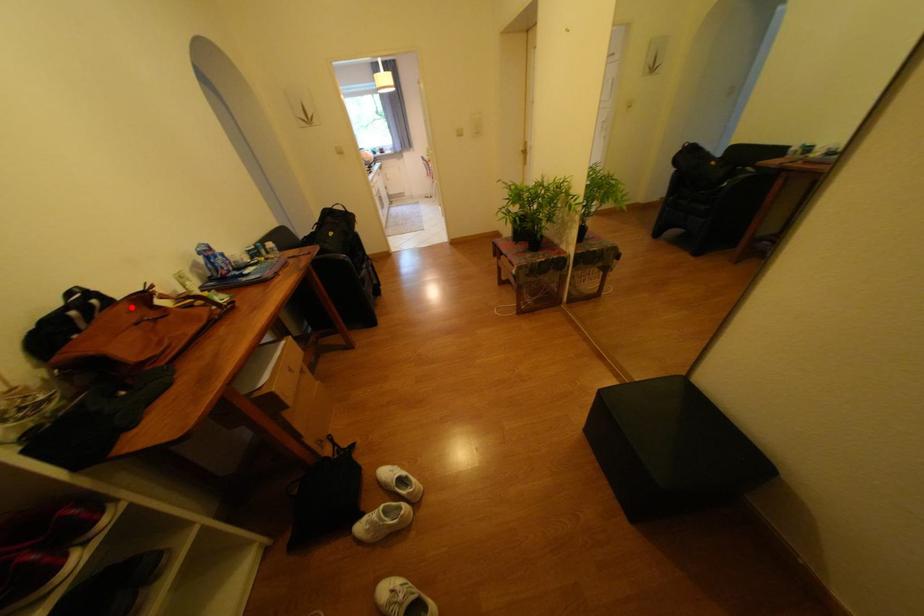
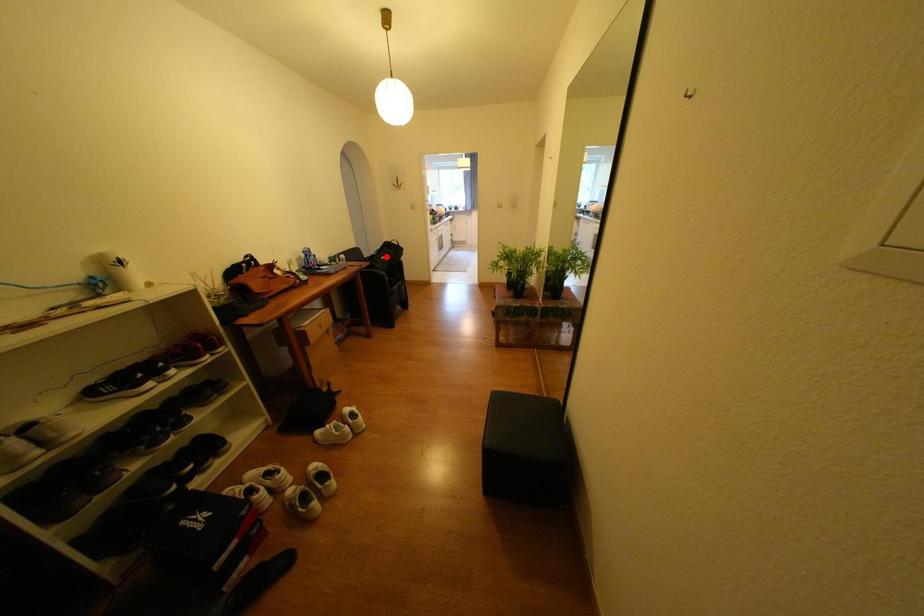
I am providing you with two images of the same scene from different viewpoints. A red point is marked on the first image and another point is marked on the second image. Is the red point in image1 aligned with the point shown in image2?

No